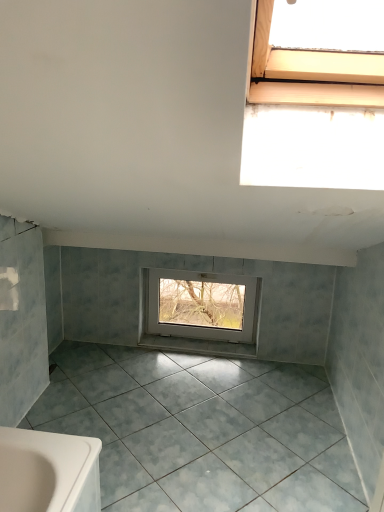
Where is `white glossy tile at center`? white glossy tile at center is located at coordinates (198, 346).

The width and height of the screenshot is (384, 512). I want to click on white glossy tile at center, so click(x=198, y=346).

Is gray matte tile at center positioned far away from white plastic window at center?

Actually, gray matte tile at center and white plastic window at center are a little close together.

This screenshot has height=512, width=384. Identify the location of window behind the gray matte tile at center. (202, 306).

Does gray matte tile at center turn towards white plastic window at center?

No.

Considering the relative positions of gray matte tile at center and white plastic window at center in the image provided, is gray matte tile at center to the right of white plastic window at center from the viewer's perspective?

Answer: Incorrect, gray matte tile at center is not on the right side of white plastic window at center.

Is white plastic window at center inside the boundaries of white glossy tile at center, or outside?

white plastic window at center is outside white glossy tile at center.

Is white plastic window at center taller than white glossy tile at center?

Correct, white plastic window at center is much taller as white glossy tile at center.

From the image's perspective, is white plastic window at center under white glossy tile at center?

Actually, white plastic window at center appears above white glossy tile at center in the image.

Is white glossy tile at center oriented towards gray matte tile at center?

Yes.

In the image, is white glossy tile at center on the left side or the right side of gray matte tile at center?

Clearly, white glossy tile at center is on the right of gray matte tile at center in the image.

Identify the location of ceramic tile on the left of white glossy tile at center. 202,430.

Who is taller, white glossy tile at center or gray matte tile at center?

Standing taller between the two is white glossy tile at center.

This screenshot has height=512, width=384. Identify the location of ceramic tile below the white plastic window at center (from the image's perspective). (202, 430).

From the picture: Considering the sizes of white plastic window at center and gray matte tile at center in the image, is white plastic window at center bigger or smaller than gray matte tile at center?

Considering their sizes, white plastic window at center takes up less space than gray matte tile at center.

What's the angular difference between white plastic window at center and gray matte tile at center's facing directions?

There is a 0.633-degree angle between the facing directions of white plastic window at center and gray matte tile at center.

Is point (213, 327) in front of point (41, 409)?

No.

Considering the positions of objects white glossy tile at center and white plastic window at center in the image provided, who is in front, white glossy tile at center or white plastic window at center?

white plastic window at center is more forward.

Based on the photo, between white glossy tile at center and white plastic window at center, which one appears on the left side from the viewer's perspective?

white glossy tile at center is more to the left.

Can you confirm if white glossy tile at center is wider than white plastic window at center?

Yes, white glossy tile at center is wider than white plastic window at center.

Is white glossy tile at center directly adjacent to white plastic window at center?

white glossy tile at center and white plastic window at center are clearly separated.

Is gray matte tile at center not within white glossy tile at center?

gray matte tile at center lies outside white glossy tile at center's area.

Is gray matte tile at center next to white glossy tile at center?

No, gray matte tile at center is not next to white glossy tile at center.

From the image's perspective, does gray matte tile at center appear higher than white glossy tile at center?

Actually, gray matte tile at center appears below white glossy tile at center in the image.

Who is bigger, gray matte tile at center or white glossy tile at center?

gray matte tile at center.

Where is `window behind the gray matte tile at center`? The height and width of the screenshot is (512, 384). window behind the gray matte tile at center is located at coordinates (202, 306).

The width and height of the screenshot is (384, 512). I want to click on window that appears on the right of white glossy tile at center, so click(x=202, y=306).

Based on their spatial positions, is gray matte tile at center or white glossy tile at center further from white plastic window at center?

The object further to white plastic window at center is gray matte tile at center.

Which object lies further to the anchor point white plastic window at center, white glossy tile at center or gray matte tile at center?

gray matte tile at center.

When comparing their distances from white glossy tile at center, does gray matte tile at center or white plastic window at center seem further?

gray matte tile at center is further to white glossy tile at center.

Which object lies further to the anchor point white glossy tile at center, white plastic window at center or gray matte tile at center?

gray matte tile at center.

When comparing their distances from gray matte tile at center, does white glossy tile at center or white plastic window at center seem closer?

white glossy tile at center lies closer to gray matte tile at center than the other object.

Consider the image. Looking at the image, which one is located closer to gray matte tile at center, white plastic window at center or white glossy tile at center?

white glossy tile at center is closer to gray matte tile at center.

Locate an element on the screen. This screenshot has height=512, width=384. window located between gray matte tile at center and white glossy tile at center in the depth direction is located at coordinates (202, 306).